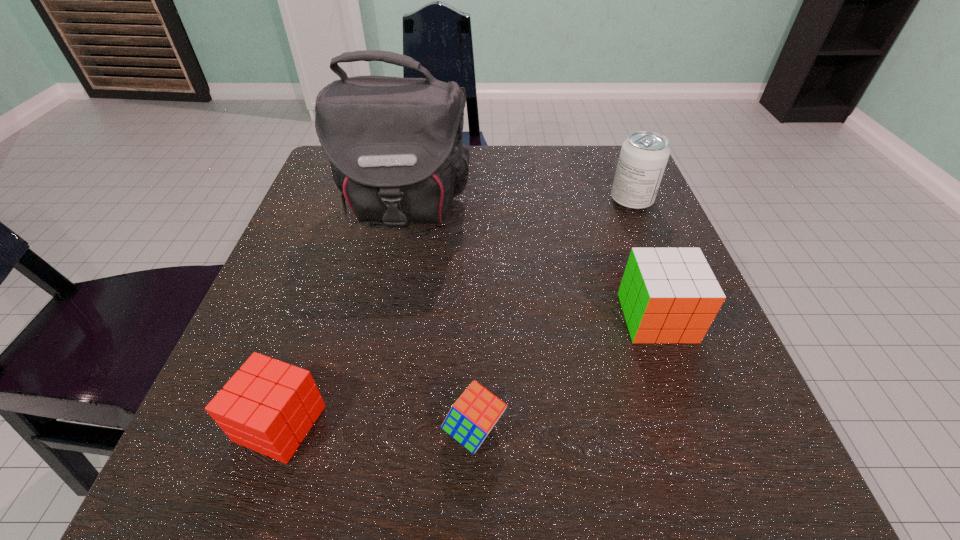
Locate an element on the screen. free space that satisfies the following two spatial constraints: 1. on the open flap of the second cube from left to right; 2. on the left side of the shoulder bag is located at coordinates (358, 430).

Image resolution: width=960 pixels, height=540 pixels. I want to click on free space that satisfies the following two spatial constraints: 1. on the open flap of the farthest cube; 2. on the right side of the shoulder bag, so click(381, 318).

At what (x,y) coordinates should I click in order to perform the action: click on free space that satisfies the following two spatial constraints: 1. on the open flap of the shoulder bag; 2. on the left side of the second cube from right to left. Please return your answer as a coordinate pair (x, y). Looking at the image, I should click on (358, 430).